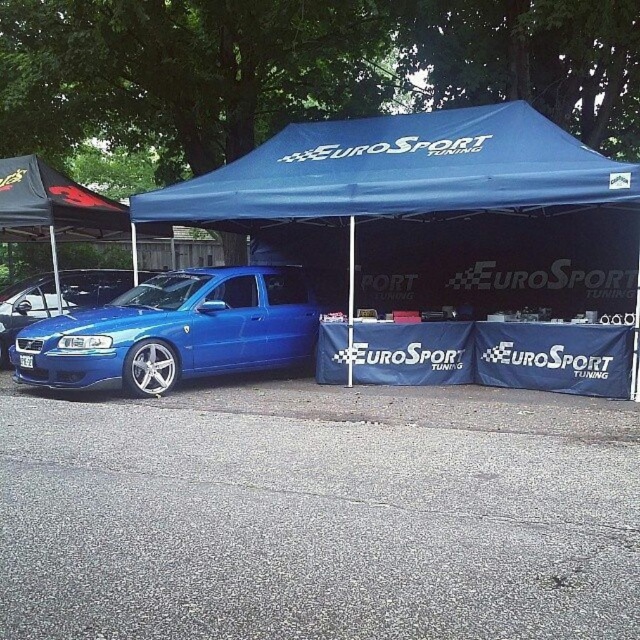
Question: Estimate the real-world distances between objects in this image. Which object is closer to the blue fabric tent at center?

Choices:
 (A) matte blue car at left
 (B) matte blue car at center

Answer: (B)

Question: Where is blue fabric tent at center located in relation to matte blue car at left in the image?

Choices:
 (A) below
 (B) above

Answer: (B)

Question: Among these objects, which one is nearest to the camera?

Choices:
 (A) matte blue car at center
 (B) matte blue car at left
 (C) blue fabric tent at center

Answer: (C)

Question: Is blue fabric tent at center further to the viewer compared to matte blue car at left?

Choices:
 (A) yes
 (B) no

Answer: (B)

Question: Considering the relative positions of matte blue car at center and matte blue car at left in the image provided, where is matte blue car at center located with respect to matte blue car at left?

Choices:
 (A) above
 (B) below

Answer: (B)

Question: Which point appears closest to the camera in this image?

Choices:
 (A) (490, 163)
 (B) (0, 317)

Answer: (A)